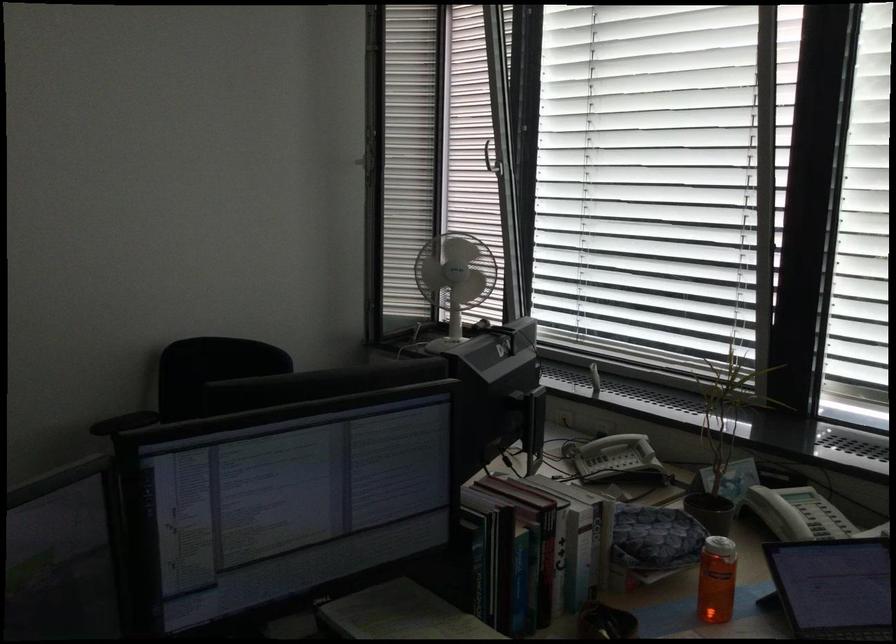
At what (x,y) coordinates should I click in order to perform the action: click on red book. Please return your answer as a coordinate pair (x, y). The image size is (896, 644). Looking at the image, I should click on (556, 545).